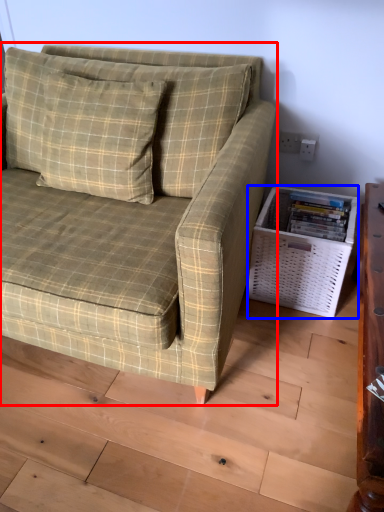
Question: Which point is further to the camera, studio couch (highlighted by a red box) or basket (highlighted by a blue box)?

Choices:
 (A) studio couch
 (B) basket

Answer: (B)